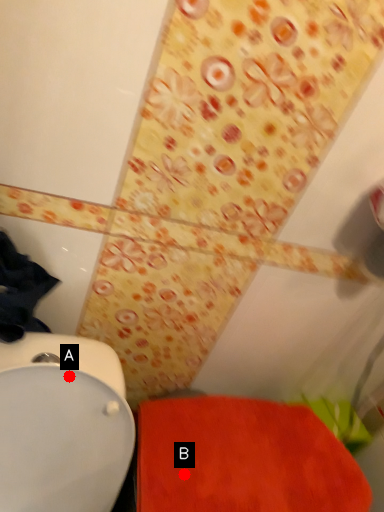
Question: Two points are circled on the image, labeled by A and B beside each circle. Which point is farther to the camera?

Choices:
 (A) A is further
 (B) B is further

Answer: (B)